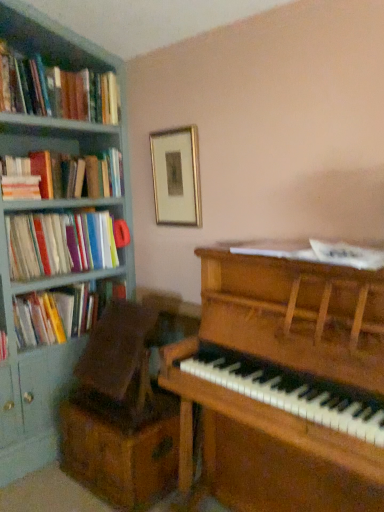
What do you see at coordinates (176, 177) in the screenshot? This screenshot has height=512, width=384. I see `gold-framed picture at upper center` at bounding box center [176, 177].

What do you see at coordinates (56, 90) in the screenshot?
I see `hardcover books at left, placed as the first book when sorted from top to bottom` at bounding box center [56, 90].

Locate an element on the screen. The height and width of the screenshot is (512, 384). wooden piano at center is located at coordinates (283, 382).

Who is more distant, hardcover books at left, placed as the first book when sorted from top to bottom, or wooden drawer at lower left?

hardcover books at left, placed as the first book when sorted from top to bottom.

Who is bigger, hardcover books at left, positioned as the fourth book in bottom-to-top order, or wooden drawer at lower left?

Bigger between the two is hardcover books at left, positioned as the fourth book in bottom-to-top order.

Is wooden drawer at lower left completely or partially inside hardcover books at left, placed as the first book when sorted from top to bottom?

No, wooden drawer at lower left is located outside of hardcover books at left, placed as the first book when sorted from top to bottom.

From a real-world perspective, who is located lower, hardcover books at left, positioned as the fourth book in bottom-to-top order, or wooden drawer at lower left?

From a 3D spatial view, wooden drawer at lower left is below.

What's the angular difference between wooden piano at center and hardcover books at left, placed as the first book when sorted from top to bottom,'s facing directions?

The facing directions of wooden piano at center and hardcover books at left, placed as the first book when sorted from top to bottom, are 90.9 degrees apart.

Based on their positions, is wooden piano at center located to the left or right of hardcover books at left, placed as the first book when sorted from top to bottom?

Clearly, wooden piano at center is on the right of hardcover books at left, placed as the first book when sorted from top to bottom, in the image.

From a real-world perspective, which is physically above, wooden piano at center or hardcover books at left, positioned as the fourth book in bottom-to-top order?

hardcover books at left, positioned as the fourth book in bottom-to-top order, is physically above.

Which is in front, point (343, 335) or point (51, 92)?

The point (343, 335) is closer to the camera.

Which of these two, hardcover books at left, the 3th book in the top-to-bottom sequence, or gold-framed picture at upper center, stands taller?

gold-framed picture at upper center is taller.

Who is bigger, hardcover books at left, marked as the 2th book in a bottom-to-top arrangement, or gold-framed picture at upper center?

Bigger between the two is hardcover books at left, marked as the 2th book in a bottom-to-top arrangement.

Considering the sizes of hardcover books at left, the 3th book in the top-to-bottom sequence, and gold-framed picture at upper center in the image, is hardcover books at left, the 3th book in the top-to-bottom sequence, wider or thinner than gold-framed picture at upper center?

hardcover books at left, the 3th book in the top-to-bottom sequence, is wider than gold-framed picture at upper center.

Which point is more forward, (101,285) or (207,390)?

The point (207,390) is closer.

Can you see hardcover book at left, the fourth book when ordered from top to bottom, touching wooden piano at center?

They are not placed beside each other.

Considering the relative sizes of hardcover book at left, the fourth book when ordered from top to bottom, and wooden piano at center in the image provided, is hardcover book at left, the fourth book when ordered from top to bottom, wider than wooden piano at center?

No.

From a real-world perspective, is hardcover book at left, the fourth book when ordered from top to bottom, below wooden piano at center?

No, from a real-world perspective, hardcover book at left, the fourth book when ordered from top to bottom, is not under wooden piano at center.

From the image's perspective, who appears lower, hardcover books at left, acting as the third book starting from the bottom, or hardcover books at left, marked as the 2th book in a bottom-to-top arrangement?

hardcover books at left, marked as the 2th book in a bottom-to-top arrangement, appears lower in the image.

Is hardcover books at left, the second book positioned from the top, located outside hardcover books at left, the 3th book in the top-to-bottom sequence?

That's correct, hardcover books at left, the second book positioned from the top, is outside of hardcover books at left, the 3th book in the top-to-bottom sequence.

From a real-world perspective, between hardcover books at left, the second book positioned from the top, and hardcover books at left, marked as the 2th book in a bottom-to-top arrangement, who is vertically higher?

hardcover books at left, the second book positioned from the top.

Considering the relative sizes of hardcover books at left, the second book positioned from the top, and hardcover books at left, marked as the 2th book in a bottom-to-top arrangement, in the image provided, is hardcover books at left, the second book positioned from the top, smaller than hardcover books at left, marked as the 2th book in a bottom-to-top arrangement,?

Yes, hardcover books at left, the second book positioned from the top, is smaller than hardcover books at left, marked as the 2th book in a bottom-to-top arrangement.

Measure the distance between wooden drawer at lower left and hardcover books at left, positioned as the fourth book in bottom-to-top order.

1.52 meters.

Which point is more distant from viewer, (146, 490) or (54, 81)?

The point (54, 81) is farther.

Is wooden drawer at lower left shorter than hardcover books at left, positioned as the fourth book in bottom-to-top order?

Incorrect, the height of wooden drawer at lower left does not fall short of that of hardcover books at left, positioned as the fourth book in bottom-to-top order.

Which of these two, wooden drawer at lower left or hardcover books at left, placed as the first book when sorted from top to bottom, is thinner?

wooden drawer at lower left.

Between hardcover books at left, acting as the third book starting from the bottom, and gold-framed picture at upper center, which one appears on the left side from the viewer's perspective?

hardcover books at left, acting as the third book starting from the bottom.

Is the surface of hardcover books at left, acting as the third book starting from the bottom, in direct contact with gold-framed picture at upper center?

hardcover books at left, acting as the third book starting from the bottom, and gold-framed picture at upper center are clearly separated.

Considering their positions, is hardcover books at left, the second book positioned from the top, located in front of or behind gold-framed picture at upper center?

In the image, hardcover books at left, the second book positioned from the top, appears in front of gold-framed picture at upper center.

Locate an element on the screen. The width and height of the screenshot is (384, 512). book that is the 3rd object to the left of the wooden drawer at lower left, starting at the anchor is located at coordinates (56, 90).

The image size is (384, 512). I want to click on piano that appears in front of the hardcover books at left, positioned as the fourth book in bottom-to-top order, so click(x=283, y=382).

When comparing their distances from hardcover books at left, the 3th book in the top-to-bottom sequence, does gold-framed picture at upper center or hardcover book at left, the first book positioned from the bottom, seem further?

The object further to hardcover books at left, the 3th book in the top-to-bottom sequence, is gold-framed picture at upper center.

From the picture: Estimate the real-world distances between objects in this image. Which object is closer to gold-framed picture at upper center, wooden piano at center or wooden drawer at lower left?

wooden piano at center.

From the picture: From the image, which object appears to be farther from wooden piano at center, hardcover books at left, the second book positioned from the top, or wooden drawer at lower left?

hardcover books at left, the second book positioned from the top, lies further to wooden piano at center than the other object.

From the image, which object appears to be nearer to wooden piano at center, hardcover books at left, the 3th book in the top-to-bottom sequence, or hardcover books at left, positioned as the fourth book in bottom-to-top order?

Based on the image, hardcover books at left, the 3th book in the top-to-bottom sequence, appears to be nearer to wooden piano at center.

Based on the photo, which object lies further to the anchor point wooden drawer at lower left, hardcover books at left, placed as the first book when sorted from top to bottom, or wooden piano at center?

The object further to wooden drawer at lower left is hardcover books at left, placed as the first book when sorted from top to bottom.

Estimate the real-world distances between objects in this image. Which object is closer to gold-framed picture at upper center, hardcover books at left, marked as the 2th book in a bottom-to-top arrangement, or hardcover books at left, positioned as the fourth book in bottom-to-top order?

hardcover books at left, positioned as the fourth book in bottom-to-top order, is closer to gold-framed picture at upper center.

Looking at the image, which one is located closer to wooden drawer at lower left, gold-framed picture at upper center or hardcover books at left, the second book positioned from the top?

gold-framed picture at upper center is closer to wooden drawer at lower left.

When comparing their distances from hardcover books at left, placed as the first book when sorted from top to bottom, does wooden drawer at lower left or hardcover books at left, the second book positioned from the top, seem further?

Among the two, wooden drawer at lower left is located further to hardcover books at left, placed as the first book when sorted from top to bottom.

You are a GUI agent. You are given a task and a screenshot of the screen. Output one action in this format:
    pyautogui.click(x=<x>, y=<y>)
    Task: Click on the picture frame that lies between hardcover books at left, the second book positioned from the top, and wooden drawer at lower left from top to bottom
    
    Given the screenshot: What is the action you would take?
    pyautogui.click(x=176, y=177)

Locate an element on the screen. picture frame between hardcover books at left, the 3th book in the top-to-bottom sequence, and wooden piano at center from left to right is located at coordinates (176, 177).

You are a GUI agent. You are given a task and a screenshot of the screen. Output one action in this format:
    pyautogui.click(x=<x>, y=<y>)
    Task: Click on the piano between hardcover books at left, acting as the third book starting from the bottom, and wooden drawer at lower left vertically
    
    Given the screenshot: What is the action you would take?
    pyautogui.click(x=283, y=382)

Where is `picture frame that lies between hardcover books at left, the second book positioned from the top, and hardcover book at left, the first book positioned from the bottom, from top to bottom`? picture frame that lies between hardcover books at left, the second book positioned from the top, and hardcover book at left, the first book positioned from the bottom, from top to bottom is located at coordinates (176, 177).